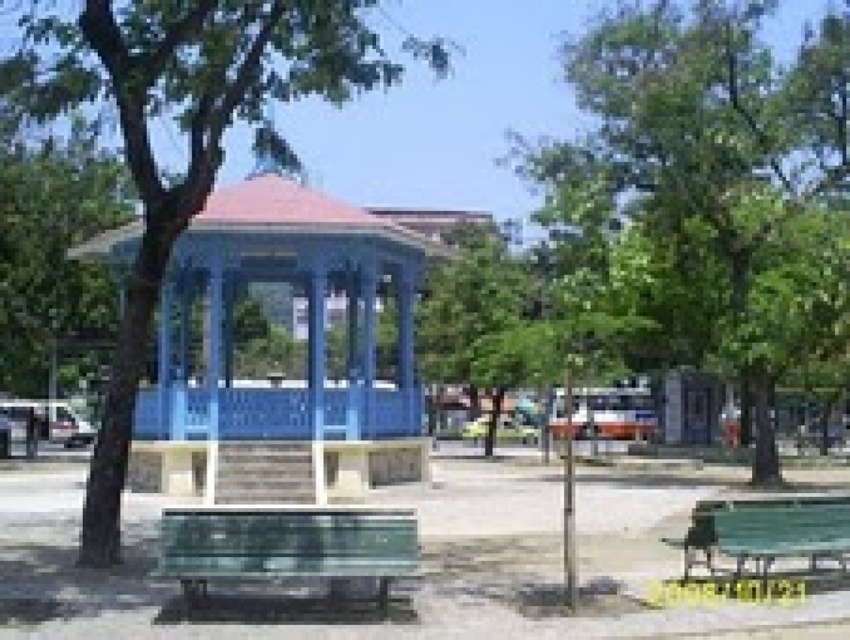
The height and width of the screenshot is (640, 850). Describe the element at coordinates (306, 330) in the screenshot. I see `blue painted wood gazebo at center` at that location.

Is blue painted wood gazebo at center in front of green plastic bench at lower center?

That is False.

Measure the distance between blue painted wood gazebo at center and camera.

A distance of 12.20 meters exists between blue painted wood gazebo at center and camera.

Locate an element on the screen. This screenshot has width=850, height=640. blue painted wood gazebo at center is located at coordinates (306, 330).

Between point (32, 17) and point (183, 582), which one is positioned in front?

Point (183, 582) is in front.

Is green wood tree at center further to the viewer compared to green plastic bench at lower center?

Yes.

Between point (389, 77) and point (324, 545), which one is positioned in front?

Point (324, 545) is more forward.

Locate an element on the screen. The height and width of the screenshot is (640, 850). green wood tree at center is located at coordinates (180, 132).

Locate an element on the screen. Image resolution: width=850 pixels, height=640 pixels. green leafy tree at center is located at coordinates (718, 186).

Who is more forward, (697, 273) or (367, 243)?

Positioned in front is point (367, 243).

Locate an element on the screen. This screenshot has height=640, width=850. green leafy tree at center is located at coordinates (718, 186).